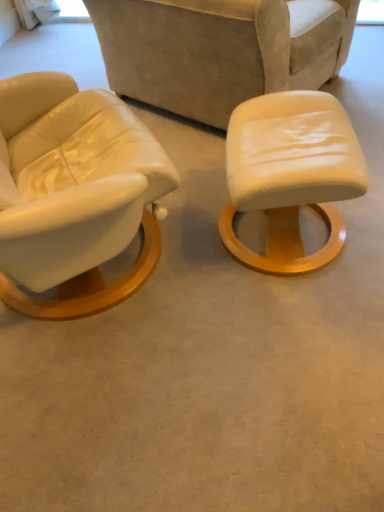
The image size is (384, 512). What do you see at coordinates (218, 50) in the screenshot?
I see `leather-like beige chair at center` at bounding box center [218, 50].

The height and width of the screenshot is (512, 384). What are the coordinates of `leather-like beige chair at center` in the screenshot? It's located at (218, 50).

Locate an element on the screen. matte white stool at center is located at coordinates (290, 174).

The image size is (384, 512). Describe the element at coordinates (290, 174) in the screenshot. I see `matte white stool at center` at that location.

You are a GUI agent. You are given a task and a screenshot of the screen. Output one action in this format:
    pyautogui.click(x=<x>, y=<y>)
    Task: Click on the leather-like beige chair at center
    The width and height of the screenshot is (384, 512).
    Given the screenshot: What is the action you would take?
    pyautogui.click(x=218, y=50)

Which object is positioned more to the left, matte white stool at center or leather-like beige chair at center?

From the viewer's perspective, leather-like beige chair at center appears more on the left side.

Which object is closer to the camera taking this photo, matte white stool at center or leather-like beige chair at center?

matte white stool at center is in front.

Is point (362, 175) less distant than point (109, 67)?

Yes.

From the image's perspective, which one is positioned lower, matte white stool at center or leather-like beige chair at center?

matte white stool at center is shown below in the image.

From a real-world perspective, is matte white stool at center positioned above or below leather-like beige chair at center?

In terms of real-world spatial position, matte white stool at center is below leather-like beige chair at center.

Which of these two, matte white stool at center or leather-like beige chair at center, is wider?

With larger width is leather-like beige chair at center.

Does matte white stool at center have a lesser height compared to leather-like beige chair at center?

Yes.

Considering the sizes of objects matte white stool at center and leather-like beige chair at center in the image provided, who is smaller, matte white stool at center or leather-like beige chair at center?

Answer: matte white stool at center.

Could leather-like beige chair at center be considered to be inside matte white stool at center?

Definitely not — leather-like beige chair at center is not inside matte white stool at center.

Is matte white stool at center next to leather-like beige chair at center and touching it?

No, matte white stool at center is not in contact with leather-like beige chair at center.

Is matte white stool at center aimed at leather-like beige chair at center?

No, matte white stool at center is not turned towards leather-like beige chair at center.

Where is `chair above the matte white stool at center (from the image's perspective)`? The height and width of the screenshot is (512, 384). chair above the matte white stool at center (from the image's perspective) is located at coordinates (218, 50).

Considering the positions of objects leather-like beige chair at center and matte white stool at center in the image provided, who is more to the right, leather-like beige chair at center or matte white stool at center?

matte white stool at center is more to the right.

Considering the positions of objects leather-like beige chair at center and matte white stool at center in the image provided, who is in front, leather-like beige chair at center or matte white stool at center?

Positioned in front is matte white stool at center.

Which is less distant, (342, 40) or (346, 158)?

Point (342, 40) appears to be farther away from the viewer than point (346, 158).

From the image's perspective, which object appears higher, leather-like beige chair at center or matte white stool at center?

leather-like beige chair at center, from the image's perspective.

From a real-world perspective, is leather-like beige chair at center positioned under matte white stool at center based on gravity?

No, from a real-world perspective, leather-like beige chair at center is not below matte white stool at center.

Considering the relative sizes of leather-like beige chair at center and matte white stool at center in the image provided, is leather-like beige chair at center wider than matte white stool at center?

Yes, leather-like beige chair at center is wider than matte white stool at center.

From their relative heights in the image, would you say leather-like beige chair at center is taller or shorter than matte white stool at center?

Clearly, leather-like beige chair at center is taller compared to matte white stool at center.

Between leather-like beige chair at center and matte white stool at center, which one has smaller size?

matte white stool at center.

Is leather-like beige chair at center inside the boundaries of matte white stool at center, or outside?

leather-like beige chair at center is not inside matte white stool at center, it's outside.

Is there a large distance between leather-like beige chair at center and matte white stool at center?

No, leather-like beige chair at center is not far away from matte white stool at center.

Consider the image. Is leather-like beige chair at center oriented away from matte white stool at center?

No, leather-like beige chair at center's orientation is not away from matte white stool at center.

How different are the orientations of leather-like beige chair at center and matte white stool at center in degrees?

They differ by 36.4 degrees in their facing directions.

Image resolution: width=384 pixels, height=512 pixels. I want to click on chair behind the matte white stool at center, so click(218, 50).

The width and height of the screenshot is (384, 512). What are the coordinates of `stool in front of the leather-like beige chair at center` in the screenshot? It's located at pos(290,174).

At what (x,y) coordinates should I click in order to perform the action: click on chair that appears on the left of matte white stool at center. Please return your answer as a coordinate pair (x, y). This screenshot has width=384, height=512. Looking at the image, I should click on (218, 50).